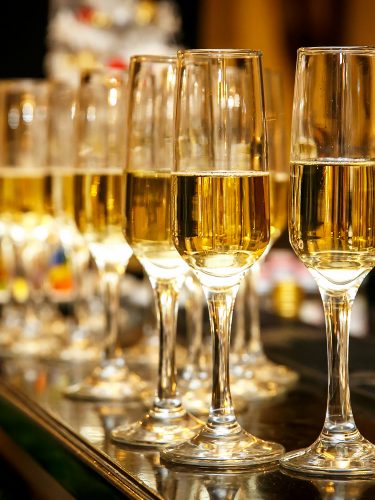
This screenshot has width=375, height=500. I want to click on rim of glass, so click(330, 48), click(256, 50), click(156, 57), click(95, 69), click(64, 80), click(22, 85).